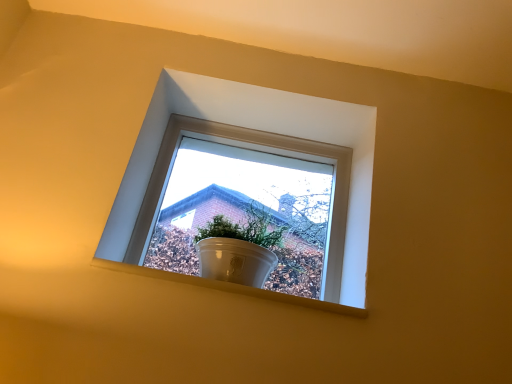
Question: From the image's perspective, is white glossy pot at upper center on top of white smooth window sill at center?

Choices:
 (A) yes
 (B) no

Answer: (A)

Question: From a real-world perspective, is white glossy pot at upper center on white smooth window sill at center?

Choices:
 (A) yes
 (B) no

Answer: (A)

Question: Could you tell me if white glossy pot at upper center is turned towards white smooth window sill at center?

Choices:
 (A) yes
 (B) no

Answer: (B)

Question: Does white glossy pot at upper center have a lesser height compared to white smooth window sill at center?

Choices:
 (A) no
 (B) yes

Answer: (A)

Question: Is white glossy pot at upper center positioned with its back to white smooth window sill at center?

Choices:
 (A) no
 (B) yes

Answer: (A)

Question: Visually, is white smooth window sill at center positioned to the left or to the right of white glossy pot at center?

Choices:
 (A) right
 (B) left

Answer: (B)

Question: From their relative heights in the image, would you say white smooth window sill at center is taller or shorter than white glossy pot at center?

Choices:
 (A) short
 (B) tall

Answer: (A)

Question: From the image's perspective, is white smooth window sill at center above or below white glossy pot at center?

Choices:
 (A) below
 (B) above

Answer: (A)

Question: Is point (262, 292) positioned closer to the camera than point (256, 178)?

Choices:
 (A) farther
 (B) closer

Answer: (B)

Question: Is white glossy pot at upper center in front of or behind white glossy pot at center in the image?

Choices:
 (A) front
 (B) behind

Answer: (B)

Question: From a real-world perspective, relative to white glossy pot at center, is white glossy pot at upper center vertically above or below?

Choices:
 (A) below
 (B) above

Answer: (B)

Question: Is point (346, 291) positioned closer to the camera than point (281, 223)?

Choices:
 (A) farther
 (B) closer

Answer: (B)

Question: Considering the positions of white glossy pot at upper center and white glossy pot at center in the image, is white glossy pot at upper center wider or thinner than white glossy pot at center?

Choices:
 (A) wide
 (B) thin

Answer: (B)

Question: From the image's perspective, is white glossy pot at center above or below white glossy pot at upper center?

Choices:
 (A) below
 (B) above

Answer: (A)

Question: Considering the positions of white glossy pot at center and white glossy pot at upper center in the image, is white glossy pot at center wider or thinner than white glossy pot at upper center?

Choices:
 (A) wide
 (B) thin

Answer: (A)